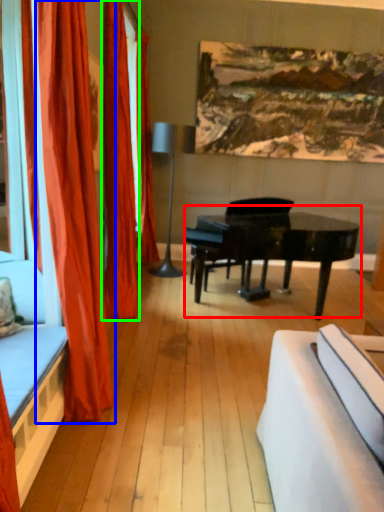
Question: Based on their relative distances, which object is nearer to piano (highlighted by a red box)? Choose from curtain (highlighted by a blue box) and curtain (highlighted by a green box).

Choices:
 (A) curtain
 (B) curtain

Answer: (B)